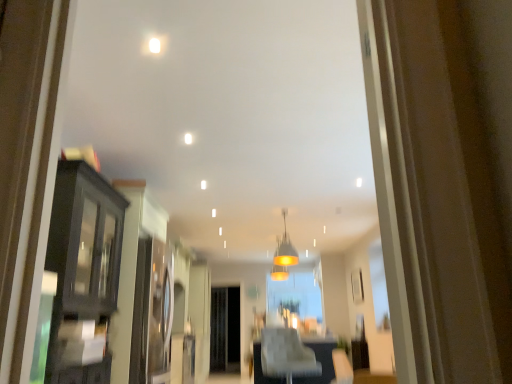
Question: Is matte black cabinet at left to the left or to the right of matte glass pendant light at center in the image?

Choices:
 (A) right
 (B) left

Answer: (B)

Question: From the image's perspective, is matte black cabinet at left located above or below matte glass pendant light at center?

Choices:
 (A) above
 (B) below

Answer: (B)

Question: Estimate the real-world distances between objects in this image. Which object is closer to the black mesh screen door at center?

Choices:
 (A) matte glass pendant light at center
 (B) white leather chair at center
 (C) clear glass door at center
 (D) matte black cabinet at left

Answer: (C)

Question: Based on their relative distances, which object is nearer to the black mesh screen door at center?

Choices:
 (A) matte glass pendant light at center
 (B) matte black cabinet at left
 (C) clear glass door at center
 (D) white leather chair at center

Answer: (C)